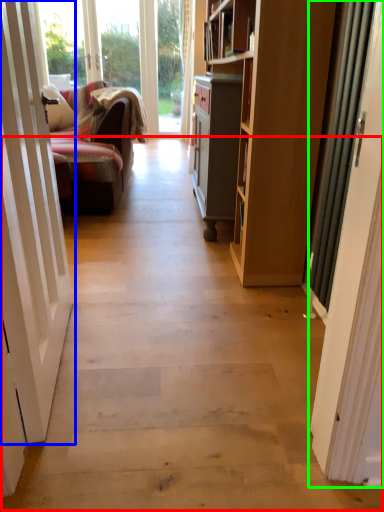
Question: Estimate the real-world distances between objects in this image. Which object is farther from path (highlighted by a red box), door (highlighted by a blue box) or door (highlighted by a green box)?

Choices:
 (A) door
 (B) door

Answer: (B)